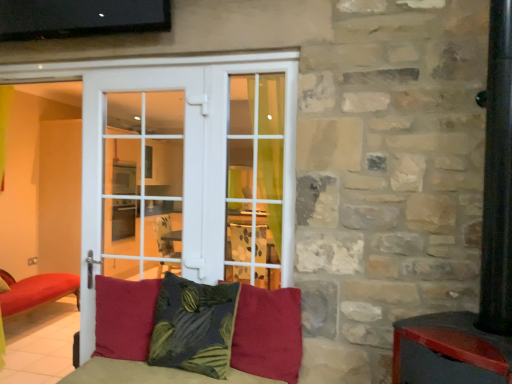
Question: In terms of size, does velvet red cushion at center, acting as the 3th pillow starting from the right, appear bigger or smaller than dark green textured pillow at center, which is the second pillow in left-to-right order?

Choices:
 (A) big
 (B) small

Answer: (B)

Question: From a real-world perspective, is velvet red cushion at center, acting as the 3th pillow starting from the right, positioned above or below dark green textured pillow at center, which is the second pillow in left-to-right order?

Choices:
 (A) below
 (B) above

Answer: (A)

Question: Which object is the farthest from the velvet red cushion at center, which is counted as the 1th pillow, starting from the left?

Choices:
 (A) white glass door at center
 (B) dark green textured pillow at center, which is the second pillow in left-to-right order
 (C) velvet red pillow at center, the 1th pillow when ordered from right to left

Answer: (C)

Question: Estimate the real-world distances between objects in this image. Which object is closer to the velvet red pillow at center, the 3th pillow in the left-to-right sequence?

Choices:
 (A) velvet red cushion at center, which is counted as the 1th pillow, starting from the left
 (B) white glass door at center
 (C) dark green textured pillow at center, the 2th pillow from the right

Answer: (C)